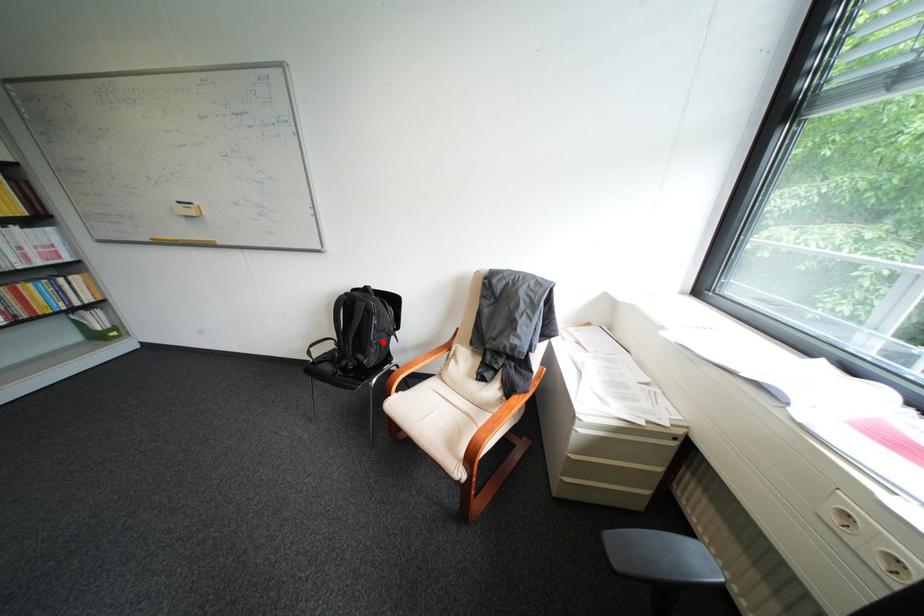
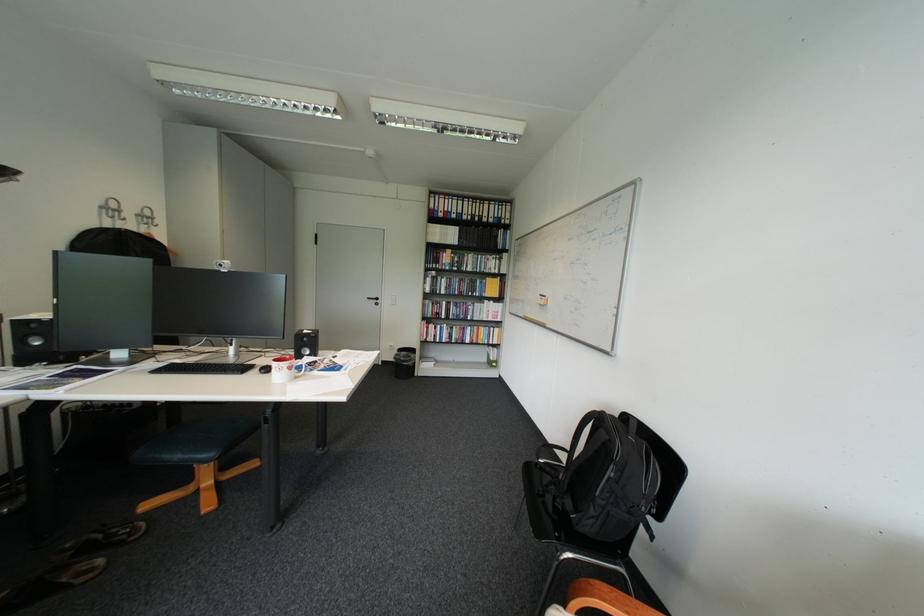
Question: I am providing you with two images of the same scene from different viewpoints. A red point is shown in image1. For the corresponding object point in image2, is it positioned nearer or farther from the camera?

Choices:
 (A) Nearer
 (B) Farther

Answer: (B)